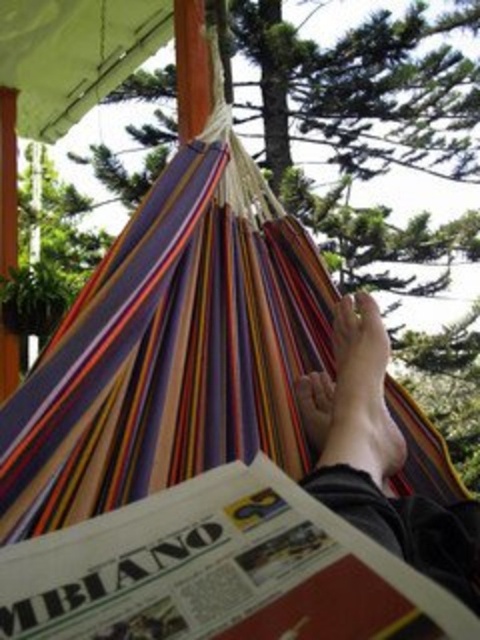
Question: Which point is farther to the camera?

Choices:
 (A) (456, 531)
 (B) (397, 460)

Answer: (B)

Question: Does multicolored fabric feet at center appear over smooth skin foot at lower center?

Choices:
 (A) no
 (B) yes

Answer: (A)

Question: Does multicolored fabric feet at center have a smaller size compared to smooth skin foot at lower center?

Choices:
 (A) no
 (B) yes

Answer: (A)

Question: Is the position of multicolored fabric feet at center more distant than that of smooth skin foot at lower center?

Choices:
 (A) yes
 (B) no

Answer: (B)

Question: Which of the following is the farthest from the observer?

Choices:
 (A) smooth skin foot at lower center
 (B) multicolored fabric feet at center

Answer: (A)